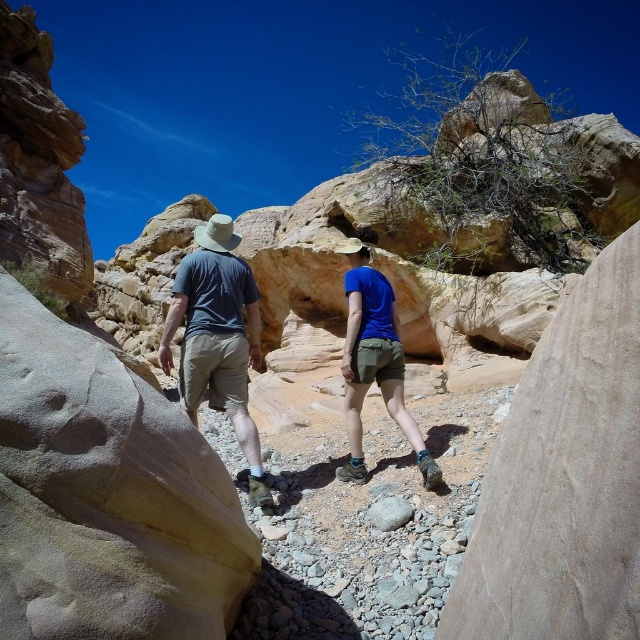
Is matte gray shirt at center taller than blue fabric shorts at center?

Correct, matte gray shirt at center is much taller as blue fabric shorts at center.

Is point (198, 253) behind point (400, 406)?

Yes, it is.

Who is more distant from viewer, (202, 380) or (364, 305)?

Positioned behind is point (364, 305).

Locate an element on the screen. This screenshot has height=640, width=640. matte gray shirt at center is located at coordinates pos(218,337).

Can you confirm if matte khaki shorts at center is positioned to the left of matte gray shirt at center?

Incorrect, matte khaki shorts at center is not on the left side of matte gray shirt at center.

Does matte khaki shorts at center have a greater width compared to matte gray shirt at center?

Yes, matte khaki shorts at center is wider than matte gray shirt at center.

Find the location of a particular element. This screenshot has width=640, height=640. matte khaki shorts at center is located at coordinates (218, 337).

Where is `matte khaki shorts at center`? The height and width of the screenshot is (640, 640). matte khaki shorts at center is located at coordinates (218, 337).

Can you confirm if matte gray shirt at center is shorter than smooth gray rock at center?

In fact, matte gray shirt at center may be taller than smooth gray rock at center.

Looking at this image, does matte gray shirt at center lie behind smooth gray rock at center?

Yes, it is behind smooth gray rock at center.

Looking at this image, measure the distance between point (202, 349) and camera.

They are 55.95 meters apart.

Identify the location of matte gray shirt at center. The height and width of the screenshot is (640, 640). (218, 337).